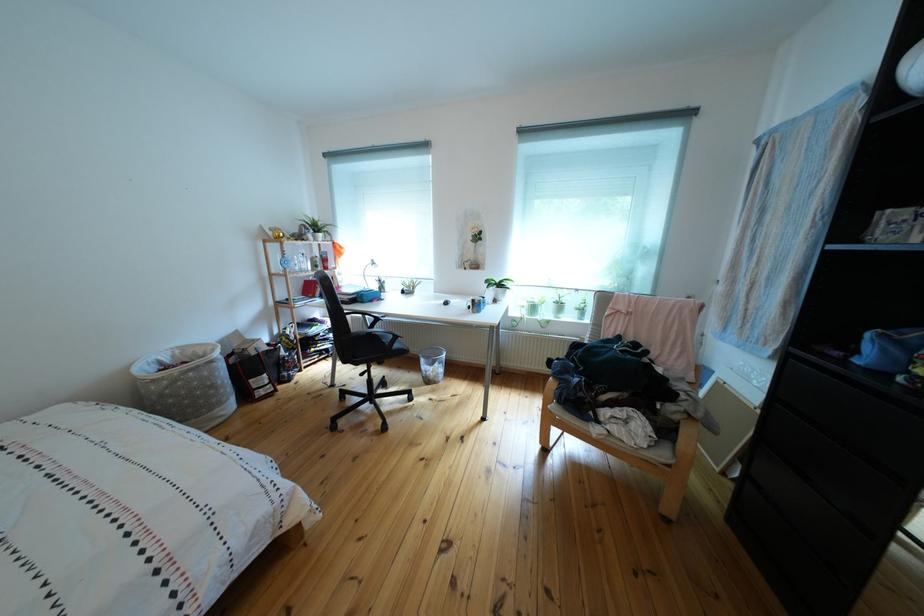
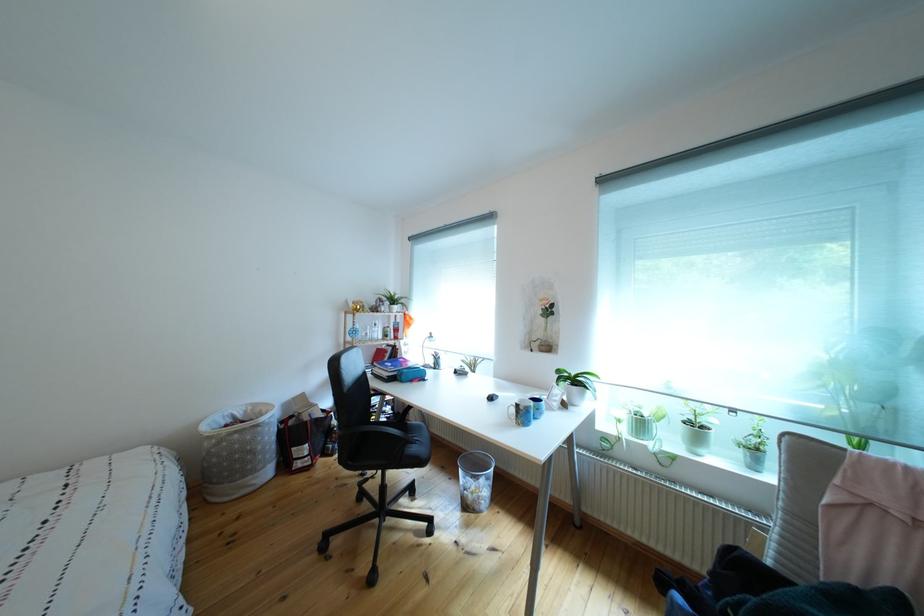
Find the pixel in the second image that matches (x=488, y=312) in the first image.

(533, 419)